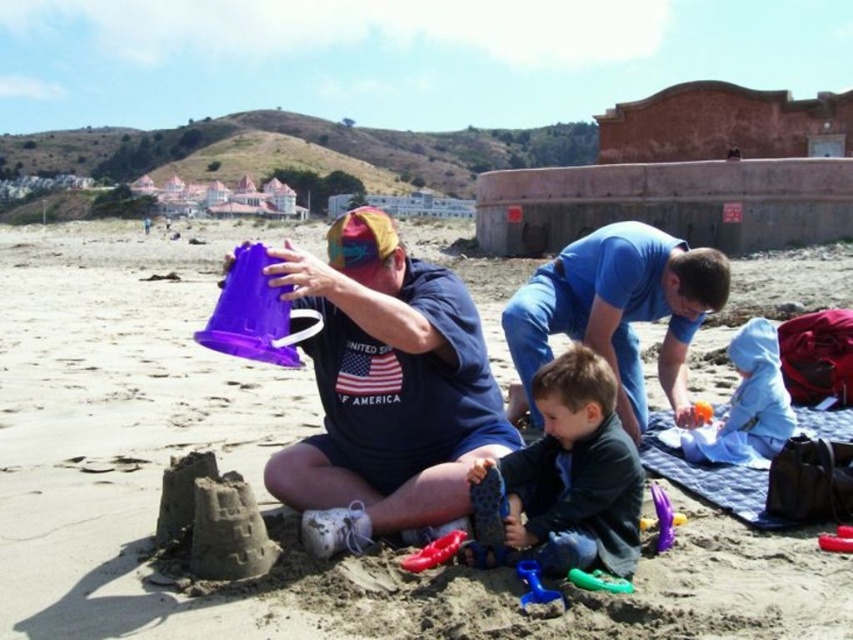
Between dark green fleece jacket at center and blue rubber boot at lower center, which one appears on the right side from the viewer's perspective?

Positioned to the right is dark green fleece jacket at center.

Is dark green fleece jacket at center taller than blue rubber boot at lower center?

Correct, dark green fleece jacket at center is much taller as blue rubber boot at lower center.

What do you see at coordinates (566, 477) in the screenshot?
I see `dark green fleece jacket at center` at bounding box center [566, 477].

At what (x,y) coordinates should I click in order to perform the action: click on dark green fleece jacket at center. Please return your answer as a coordinate pair (x, y). The height and width of the screenshot is (640, 853). Looking at the image, I should click on (566, 477).

Can you confirm if purple plastic bucket at center is taller than purple plastic shovel at lower center?

Yes, purple plastic bucket at center is taller than purple plastic shovel at lower center.

Between purple plastic bucket at center and purple plastic shovel at lower center, which one has more height?

With more height is purple plastic bucket at center.

Does point (175, 285) lie behind point (665, 512)?

Yes.

Find the location of `purple plastic bucket at center`. purple plastic bucket at center is located at coordinates (260, 476).

Between purple plastic shovel at lower center and rubberized plastic shovel at lower right, which one appears on the left side from the viewer's perspective?

purple plastic shovel at lower center is more to the left.

Does point (659, 500) come farther from viewer compared to point (704, 403)?

No, it is not.

Measure the distance between point (x=659, y=524) and camera.

A distance of 31.60 meters exists between point (x=659, y=524) and camera.

Where is `purple plastic shovel at lower center`? This screenshot has width=853, height=640. purple plastic shovel at lower center is located at coordinates (662, 516).